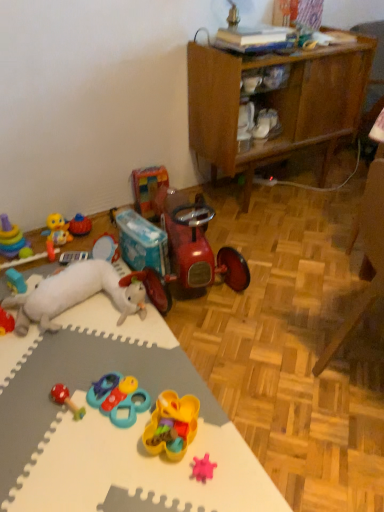
Where is `vacant area that lies to the right of shiny red tricycle at center, acting as the third toy starting from the right`? This screenshot has height=512, width=384. vacant area that lies to the right of shiny red tricycle at center, acting as the third toy starting from the right is located at coordinates (285, 261).